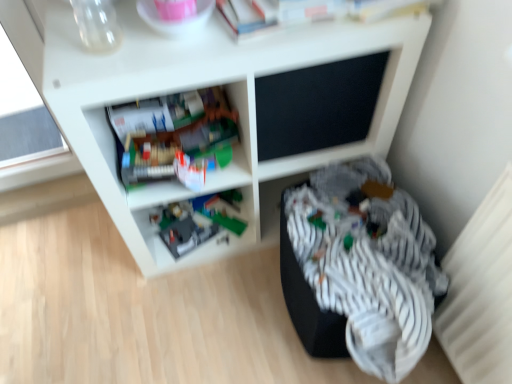
Where is `vacant area that lies between white matte shelf at center, arranged as the 1th shelf when viewed from the front, and striped fabric at lower right`? This screenshot has height=384, width=512. vacant area that lies between white matte shelf at center, arranged as the 1th shelf when viewed from the front, and striped fabric at lower right is located at coordinates (237, 306).